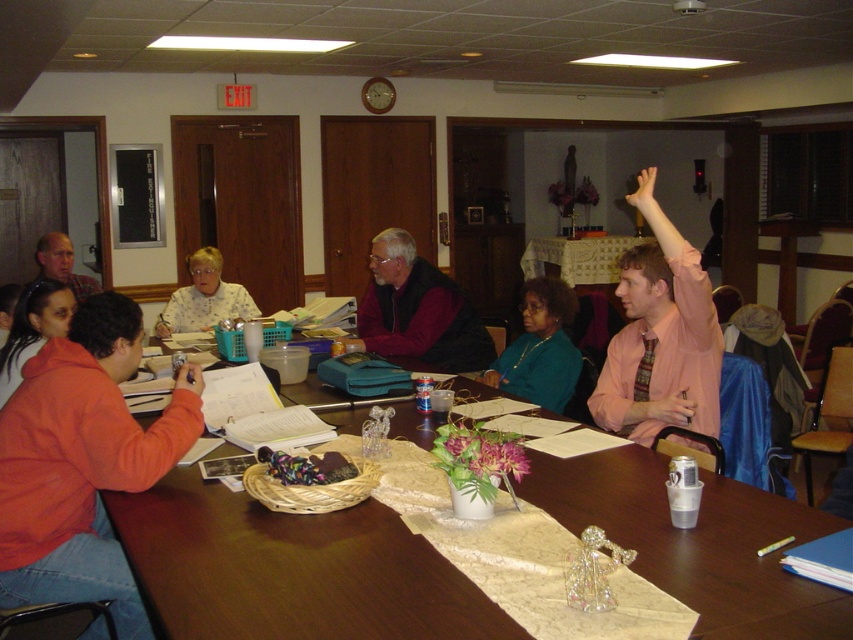
You are a person sitting at the wooden table at center. You want to place a book on the white lace tablecloth at center. Can you do that?

The wooden table at center has a lesser height compared to white lace tablecloth at center, so the tablecloth is higher than the table. Therefore, you cannot place the book on the tablecloth because it is elevated above the table surface.

In the scene shown: You are standing at the front edge of the table in the meeting room. There are two points marked on the table surface. One is at coordinates point (577, 282) and the other at point (291, 472). If you want to move an object from the first point to the second, which direction should you move it relative to your position?

You should move the object from point (577, 282) towards the front edge of the table since point (291, 472) is in front of point (577, 282) relative to your position at the front edge.

You are a photographer standing at the back of the room. You want to take a photo that includes both the matte black hair at upper left and the pink flesh at upper right. Given that your camera has a maximum zoom range of 2 meters, will you need to zoom in or can you capture both subjects in the frame without zooming?

The matte black hair at upper left and pink flesh at upper right are 3.60 meters apart. Since the camera can only zoom up to 2 meters, you will need to zoom in to capture both subjects in the frame.